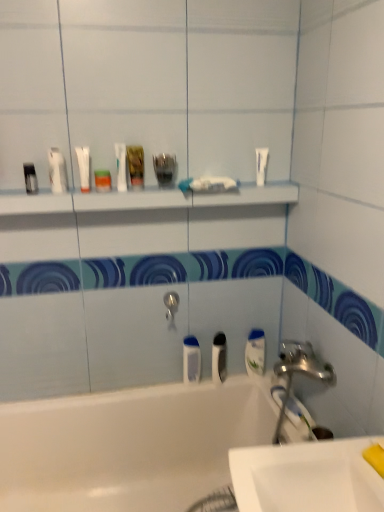
The height and width of the screenshot is (512, 384). Find the location of `vacant space positioned to the left of translucent plastic mouthwash at center, which appears as the 1th mouthwash when ordered from the bottom`. vacant space positioned to the left of translucent plastic mouthwash at center, which appears as the 1th mouthwash when ordered from the bottom is located at coordinates (162, 386).